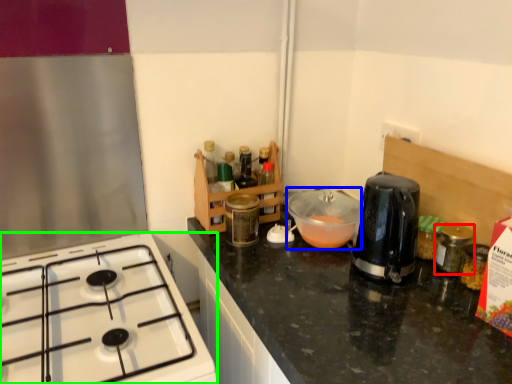
Question: Considering the real-world distances, which object is farthest from bottle (highlighted by a red box)? bowl (highlighted by a blue box) or gas stove (highlighted by a green box)?

Choices:
 (A) bowl
 (B) gas stove

Answer: (B)